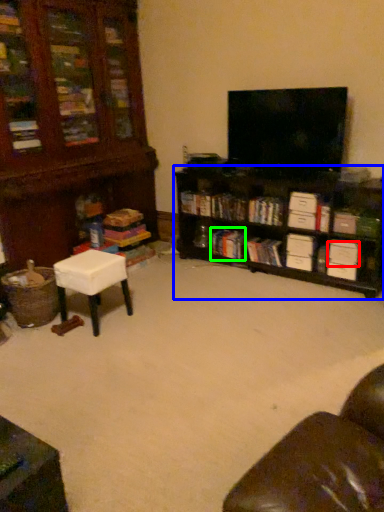
Question: Which is farther away from drawer (highlighted by a red box)? shelf (highlighted by a blue box) or book (highlighted by a green box)?

Choices:
 (A) shelf
 (B) book

Answer: (B)